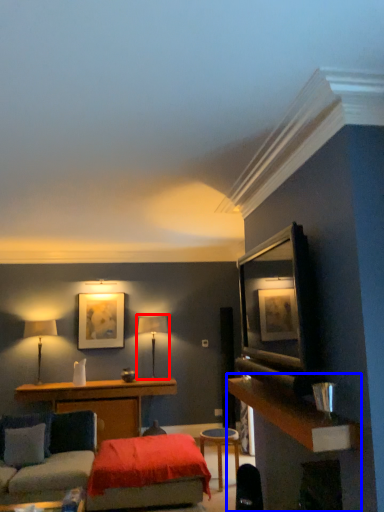
Question: Which object appears closest to the camera in this image, table lamp (highlighted by a red box) or dresser (highlighted by a blue box)?

Choices:
 (A) table lamp
 (B) dresser

Answer: (B)